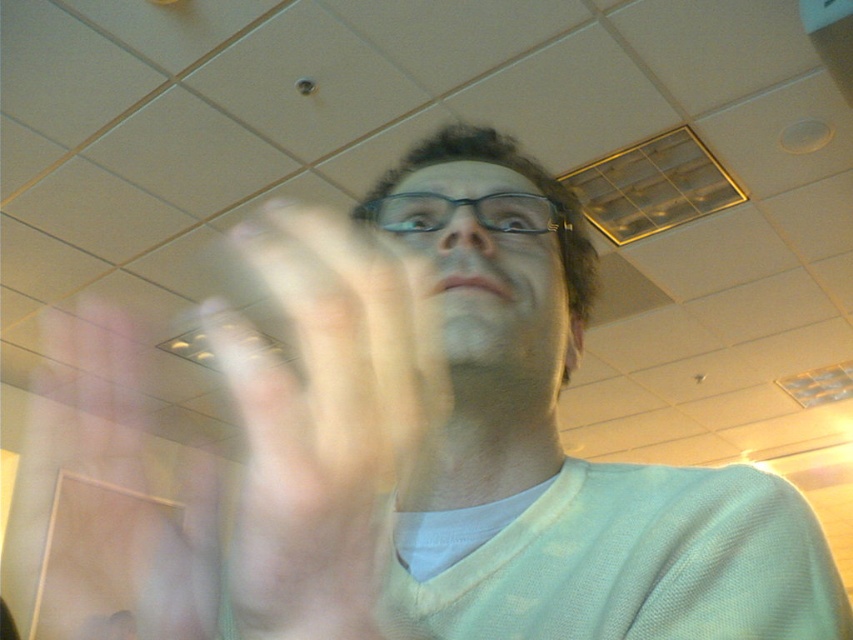
You are a photographer trying to capture a clear shot of the person in the scene. Since the person is moving, you decide to focus on the light green sweater at center and the transparent plastic glasses at center. Which object should you focus on first to ensure both are in focus, considering their positions?

The light green sweater at center is positioned on the right side of transparent plastic glasses at center. Therefore, you should focus on the transparent plastic glasses at center first since it is closer to the left side, allowing the sweater to fall into the focus range as well.

You are a photographer trying to capture a clear shot of the translucent flesh at center and transparent plastic glasses at center. Since the person moved slightly, you want to adjust your focus to ensure both objects are in frame. Based on their positions, which object should you focus on first to ensure they are both in the shot?

The translucent flesh at center is to the left of transparent plastic glasses at center, so you should focus on the translucent flesh at center first to ensure both objects remain in frame as you adjust.

You are standing in the cafe and want to determine the spatial relationship between the two points marked in the image. Which point is nearer to you, point [334,572] or point [461,198]?

Point [334,572] is closer to the viewer than point [461,198].